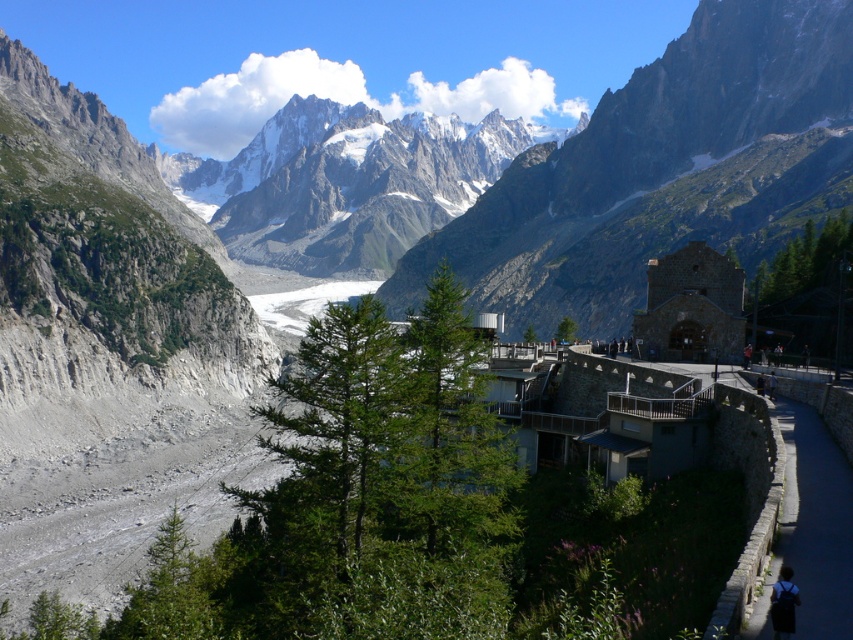
Question: Considering the relative positions of gray rock mountain range at upper center and black fabric backpack at lower right in the image provided, where is gray rock mountain range at upper center located with respect to black fabric backpack at lower right?

Choices:
 (A) above
 (B) below

Answer: (A)

Question: Among these objects, which one is farthest from the camera?

Choices:
 (A) dark gray stone wall at lower right
 (B) black fabric backpack at lower right
 (C) gray rock mountain range at upper center

Answer: (C)

Question: Can you confirm if gray rock mountain range at upper center is wider than black fabric backpack at lower right?

Choices:
 (A) no
 (B) yes

Answer: (B)

Question: Can you confirm if gray rock mountain range at upper center is positioned above rugged stone mountain at center?

Choices:
 (A) yes
 (B) no

Answer: (A)

Question: Which point is farther to the camera?

Choices:
 (A) (808, 608)
 (B) (776, 611)
 (C) (845, 164)
 (D) (717, 243)

Answer: (C)

Question: Which point is farther from the camera taking this photo?

Choices:
 (A) (474, 259)
 (B) (782, 624)

Answer: (A)